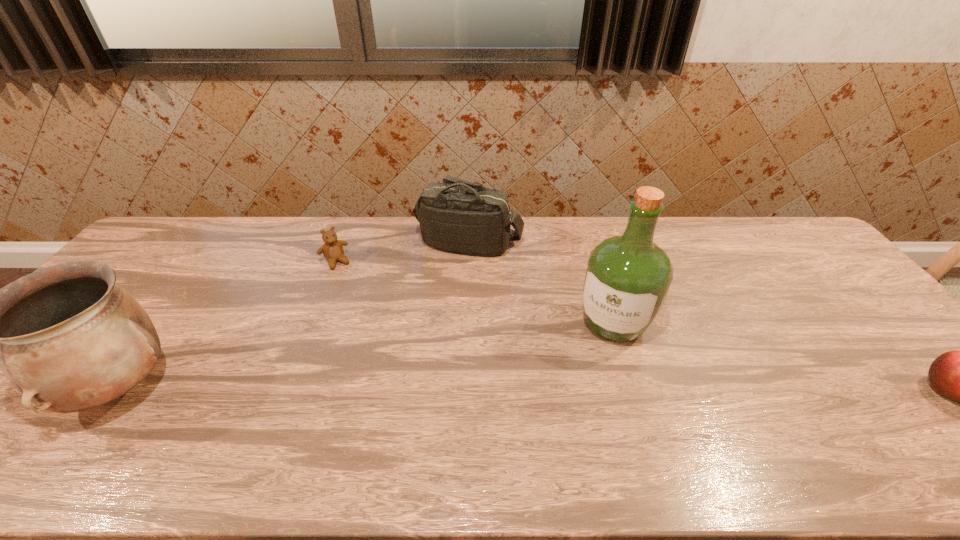
Where is `object that is at the near left corner`? Image resolution: width=960 pixels, height=540 pixels. object that is at the near left corner is located at coordinates (69, 338).

You are a GUI agent. You are given a task and a screenshot of the screen. Output one action in this format:
    pyautogui.click(x=<x>, y=<y>)
    Task: Click on the vacant area at the far edge
    
    Given the screenshot: What is the action you would take?
    pyautogui.click(x=290, y=242)

The width and height of the screenshot is (960, 540). I want to click on vacant area at the near edge of the desktop, so click(x=495, y=402).

Locate an element on the screen. The height and width of the screenshot is (540, 960). vacant space at the right edge of the desktop is located at coordinates (889, 380).

Locate an element on the screen. The width and height of the screenshot is (960, 540). vacant area at the far left corner of the desktop is located at coordinates (169, 233).

Locate an element on the screen. empty location between the leftmost object and the third object from right to left is located at coordinates (294, 315).

Find the location of a particular element. free space between the tallest object and the third tallest object is located at coordinates (541, 284).

Identify the location of blank region between the liquor and the teddy bear. This screenshot has height=540, width=960. (474, 293).

I want to click on vacant area that lies between the liquor and the leftmost object, so click(367, 356).

Find the location of a particular element. vacant point located between the fourth object from left to right and the leftmost object is located at coordinates (367, 356).